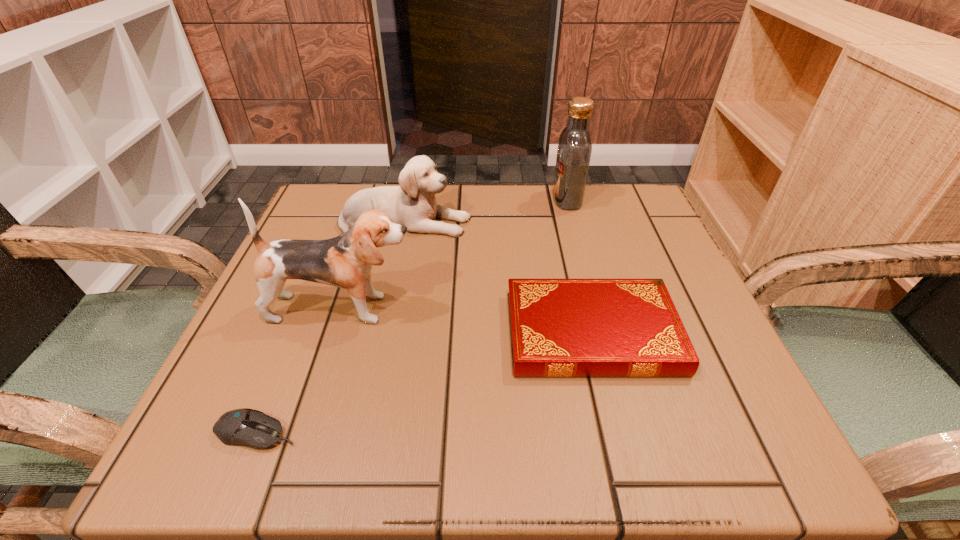
This screenshot has width=960, height=540. In order to click on vodka in this screenshot , I will do `click(574, 151)`.

This screenshot has width=960, height=540. I want to click on the nearer puppy, so click(345, 261).

Where is `the shorter puppy`? the shorter puppy is located at coordinates (413, 204).

The width and height of the screenshot is (960, 540). Identify the location of the farther puppy. (413, 204).

Where is `hardback book`? hardback book is located at coordinates (558, 327).

Find the location of a particular element. This screenshot has width=960, height=540. computer mouse is located at coordinates (246, 427).

Locate an element on the screen. the nearest object is located at coordinates [x=246, y=427].

At what (x,y) coordinates should I click in order to perform the action: click on free space located on the front-facing side of the vodka. Please return your answer as a coordinate pair (x, y). Image resolution: width=960 pixels, height=540 pixels. Looking at the image, I should click on (480, 199).

Identify the location of blank space located on the front-facing side of the vodka. (450, 199).

This screenshot has width=960, height=540. I want to click on blank area located 0.060m on the front-facing side of the vodka, so click(527, 199).